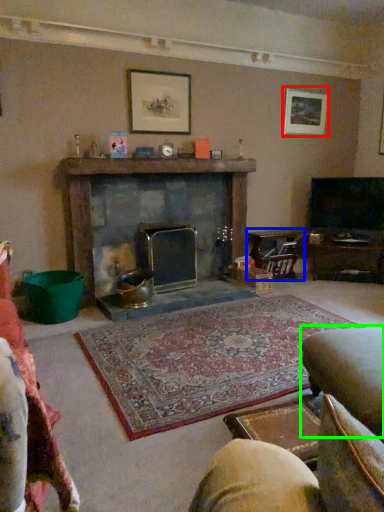
Question: Based on their relative distances, which object is nearer to picture frame (highlighted by a red box)? Choose from table (highlighted by a blue box) and swivel chair (highlighted by a green box).

Choices:
 (A) table
 (B) swivel chair

Answer: (A)